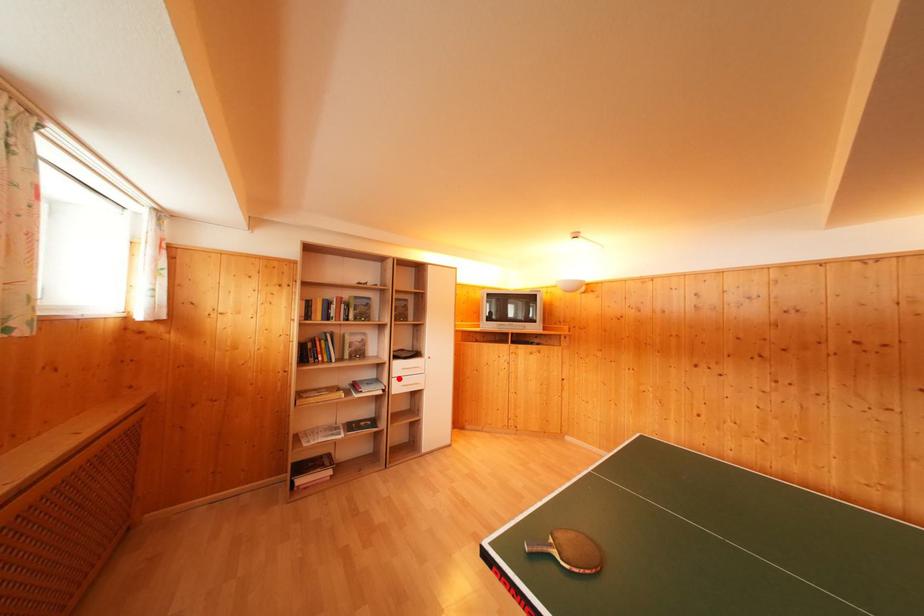
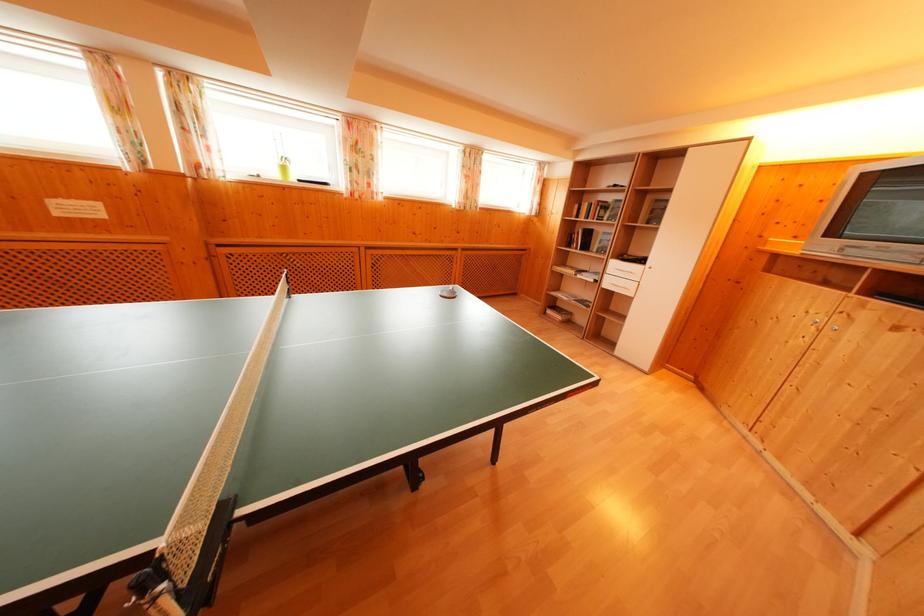
Locate, in the second image, the point that corresponds to the highlighted location in the first image.

(614, 276)